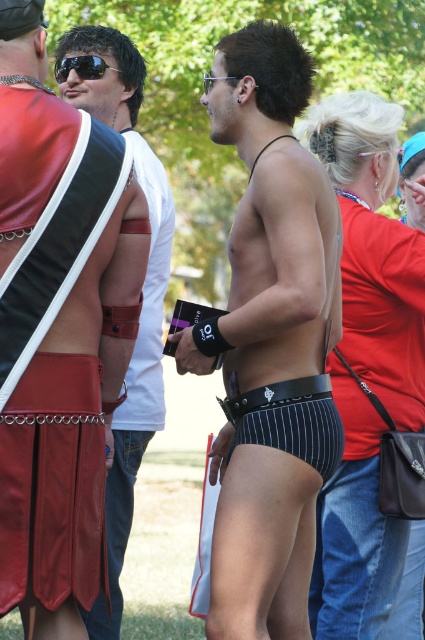
Question: Is black mesh bikini top at center to the right of matte black shorts at center from the viewer's perspective?

Choices:
 (A) yes
 (B) no

Answer: (A)

Question: Does leather shorts at lower center have a larger size compared to shiny black sunglasses at upper left?

Choices:
 (A) no
 (B) yes

Answer: (B)

Question: Which of the following is the closest to the observer?

Choices:
 (A) leather shorts at lower center
 (B) black pinstripe underwear at center
 (C) shiny black sunglasses at upper left

Answer: (B)

Question: Can you confirm if black pinstripe underwear at center is positioned to the right of black mesh bikini top at center?

Choices:
 (A) no
 (B) yes

Answer: (A)

Question: Which point is farther to the camera?

Choices:
 (A) (11, 538)
 (B) (85, 99)
 (C) (98, 76)
 (D) (391, 115)

Answer: (C)

Question: Among these points, which one is farthest from the camera?

Choices:
 (A) (65, 504)
 (B) (226, 385)
 (C) (351, 172)

Answer: (C)